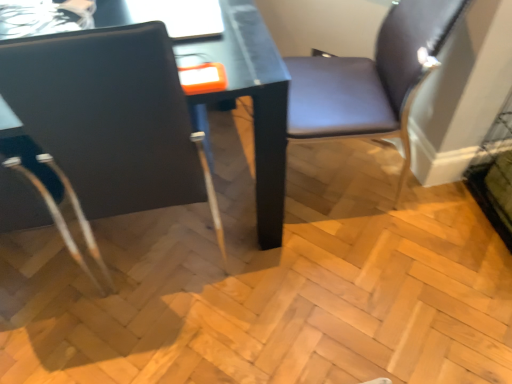
Locate an element on the screen. This screenshot has width=512, height=384. free spot in front of purple leather chair at right, placed as the second chair when sorted from left to right is located at coordinates (351, 263).